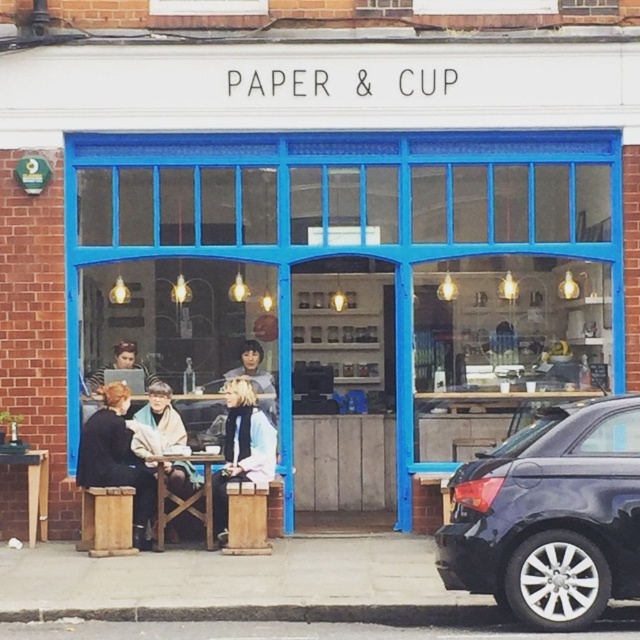
Question: Is dark brown leather jacket at lower left to the left of white woolen scarf at center from the viewer's perspective?

Choices:
 (A) no
 (B) yes

Answer: (B)

Question: Considering the relative positions of wooden bench at lower left and dark brown leather jacket at lower left in the image provided, where is wooden bench at lower left located with respect to dark brown leather jacket at lower left?

Choices:
 (A) right
 (B) left

Answer: (A)

Question: Does light brown wooden stool at center appear under blonde hair at center?

Choices:
 (A) yes
 (B) no

Answer: (A)

Question: Which point is farther from the camera taking this photo?

Choices:
 (A) (260, 356)
 (B) (163, 412)

Answer: (A)

Question: Which of the following is the farthest from the observer?

Choices:
 (A) (170, 428)
 (B) (220, 540)
 (C) (131, 362)
 (D) (109, 211)

Answer: (C)

Question: Considering the real-world distances, which object is farthest from the dark brown leather jacket at lower left?

Choices:
 (A) blonde hair at center
 (B) light brown wooden stool at center
 (C) shiny black car at right

Answer: (C)